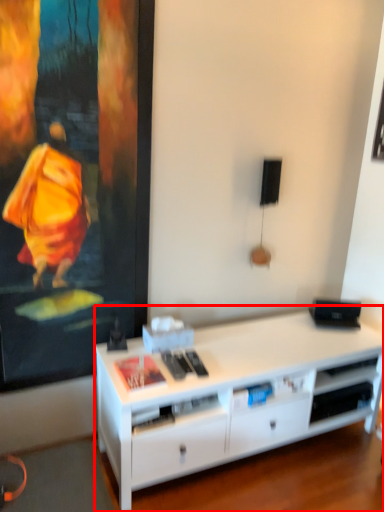
Question: From the image's perspective, what is the correct spatial positioning of desk (annotated by the red box) in reference to shelf?

Choices:
 (A) above
 (B) below

Answer: (A)